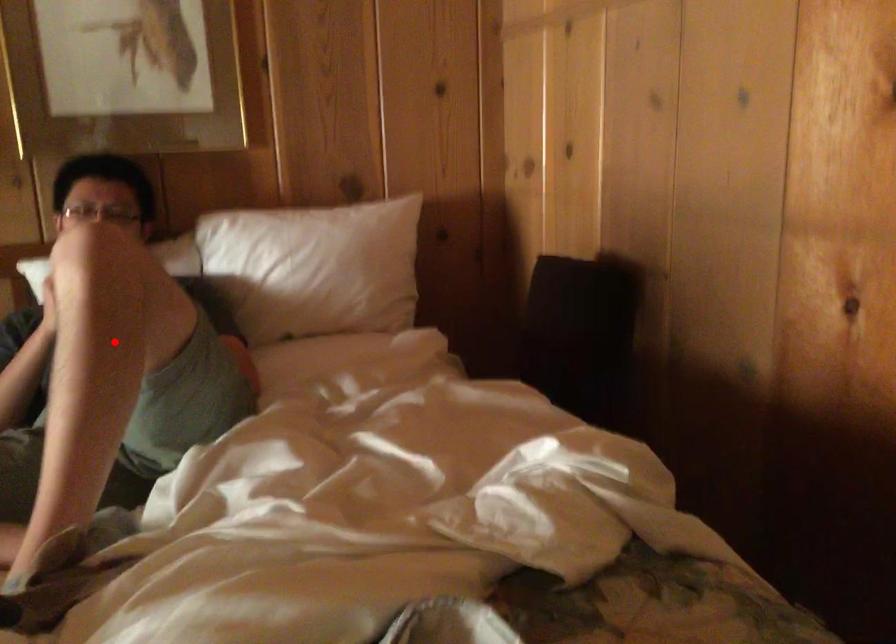
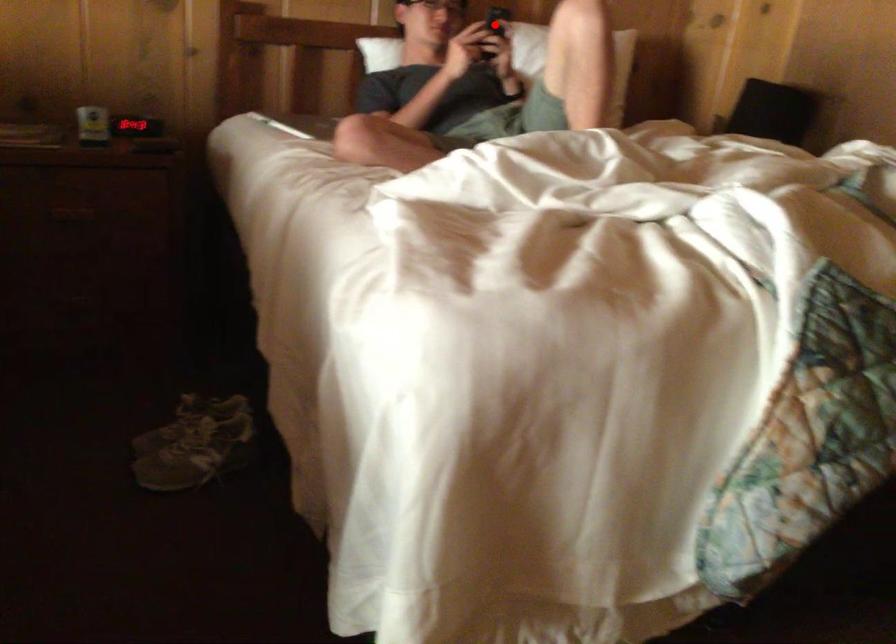
I am providing you with two images of the same scene from different viewpoints. A red point is marked on the first image and another point is marked on the second image. Are the points marked in image1 and image2 representing the same 3D position?

No